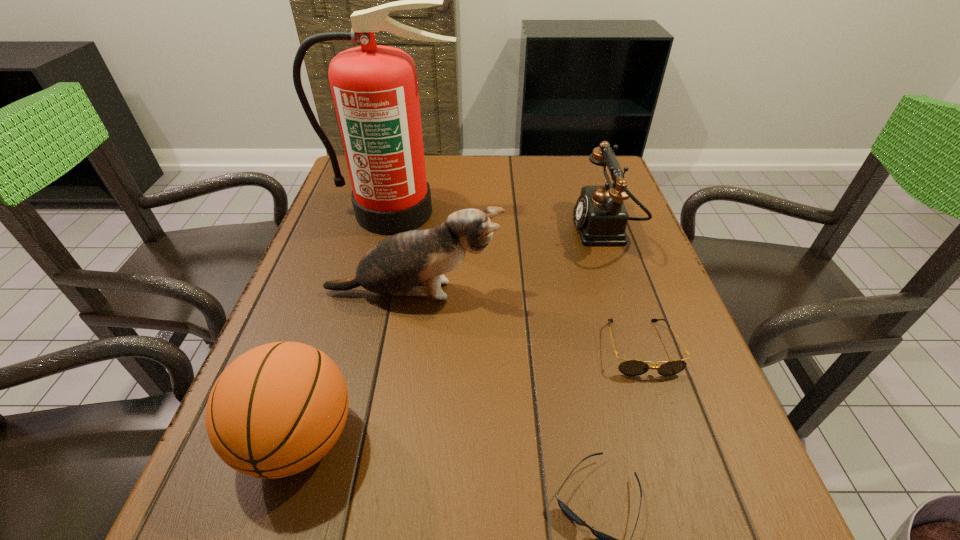
Locate an element on the screen. The image size is (960, 540). object that is at the far left corner is located at coordinates (374, 88).

Identify the location of object that is at the near left corner. (276, 410).

At what (x,y) coordinates should I click in order to perform the action: click on free space at the far edge of the desktop. Please return your answer as a coordinate pair (x, y). Image resolution: width=960 pixels, height=540 pixels. Looking at the image, I should click on (554, 172).

In the image, there is a desktop. Where is `vacant space at the near edge`? vacant space at the near edge is located at coordinates (480, 519).

Locate an element on the screen. vacant space at the left edge of the desktop is located at coordinates (306, 302).

The width and height of the screenshot is (960, 540). In order to click on free region at the right edge of the desktop in this screenshot , I will do `click(638, 270)`.

Locate an element on the screen. The width and height of the screenshot is (960, 540). vacant space at the near left corner is located at coordinates pyautogui.click(x=302, y=511).

What are the coordinates of `empty space that is in between the right sunglasses and the telephone` in the screenshot? It's located at (622, 289).

This screenshot has width=960, height=540. Identify the location of vacant region between the telephone and the tallest object. [500, 221].

Identify the location of vacant region between the telephone and the cat. (509, 261).